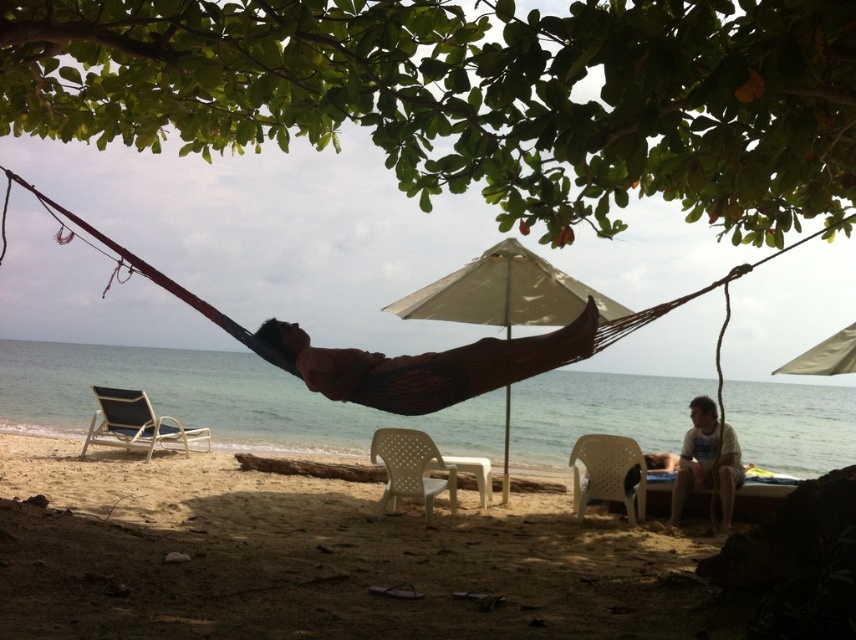
In the scene shown: Who is positioned more to the left, green leafy tree at upper center or beige fabric umbrella at center?

beige fabric umbrella at center

Is green leafy tree at upper center bigger than beige fabric umbrella at center?

Incorrect, green leafy tree at upper center is not larger than beige fabric umbrella at center.

Is point (581, 113) in front of point (468, 300)?

Yes.

At what (x,y) coordinates should I click in order to perform the action: click on green leafy tree at upper center. Please return your answer as a coordinate pair (x, y). Looking at the image, I should click on (473, 97).

Does white plastic chair at center appear on the left side of tan fabric umbrella at upper center?

Yes, white plastic chair at center is to the left of tan fabric umbrella at upper center.

Is white plastic chair at center to the right of tan fabric umbrella at upper center from the viewer's perspective?

In fact, white plastic chair at center is to the left of tan fabric umbrella at upper center.

Which is in front, point (452, 477) or point (846, 369)?

Point (846, 369) is more forward.

Identify the location of white plastic chair at center. (409, 468).

Is the position of green leafy tree at upper center less distant than that of white plastic beach chair at left?

That is True.

Between point (670, 4) and point (182, 436), which one is positioned behind?

Positioned behind is point (182, 436).

Identify the location of green leafy tree at upper center. (473, 97).